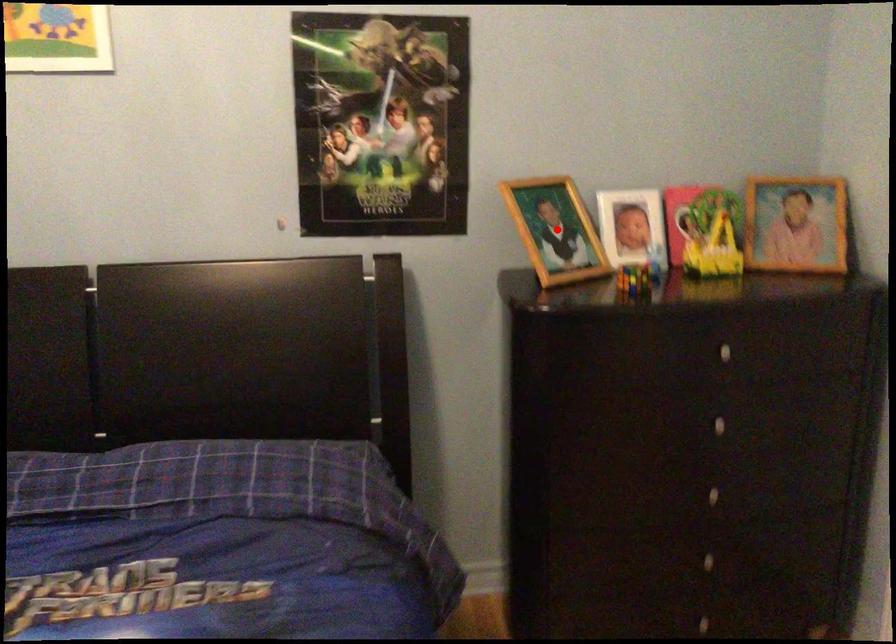
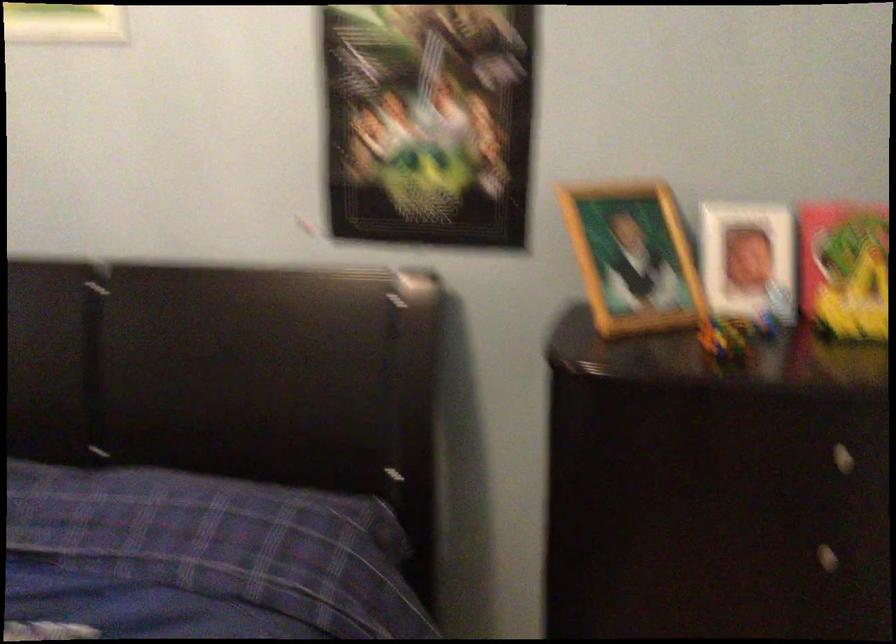
Question: I am providing you with two images of the same scene from different viewpoints. Given a red point in image1, look at the same physical point in image2. Is it:

Choices:
 (A) Closer to the viewpoint
 (B) Farther from the viewpoint

Answer: (A)